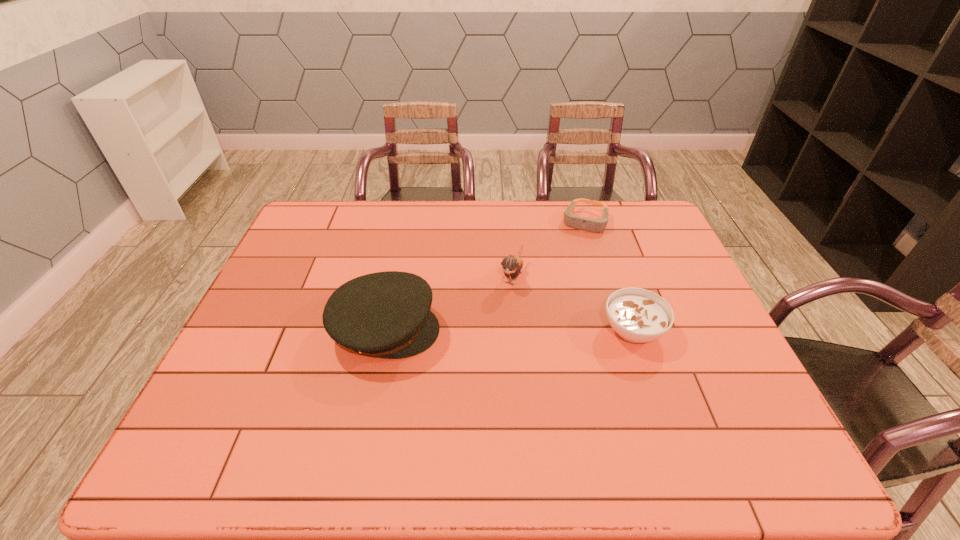
You are a GUI agent. You are given a task and a screenshot of the screen. Output one action in this format:
    pyautogui.click(x=<x>, y=<y>)
    Task: Click on the free point located 0.300m on the front-facing side of the third shortest object
    This screenshot has width=960, height=540.
    Given the screenshot: What is the action you would take?
    pyautogui.click(x=467, y=372)

Where is `free space located 0.060m on the front-facing side of the third shortest object`? free space located 0.060m on the front-facing side of the third shortest object is located at coordinates (501, 305).

Identify the location of vacant space situated 0.400m on the front and back of the goggles. The width and height of the screenshot is (960, 540). (551, 320).

This screenshot has height=540, width=960. I want to click on vacant space located on the front and back of the goggles, so click(x=570, y=266).

Where is `free location located on the front and back of the goggles`? The width and height of the screenshot is (960, 540). free location located on the front and back of the goggles is located at coordinates (555, 310).

In order to click on object that is at the far edge in this screenshot , I will do `click(576, 222)`.

Locate an element on the screen. object present at the right edge is located at coordinates (638, 315).

Identify the location of free space at the far edge of the desktop. This screenshot has height=540, width=960. (549, 220).

The height and width of the screenshot is (540, 960). What are the coordinates of `vacant space at the near edge` in the screenshot? It's located at (637, 390).

The image size is (960, 540). I want to click on vacant space at the left edge of the desktop, so click(300, 252).